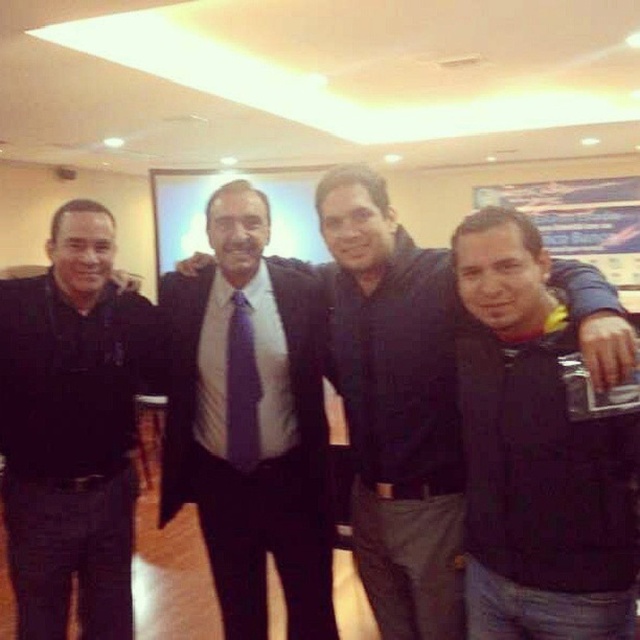
Between point (448, 525) and point (244, 385), which one is positioned behind?

Point (244, 385)

Looking at this image, does matte black suit at center have a lesser width compared to purple textured tie at center?

No.

Image resolution: width=640 pixels, height=640 pixels. What do you see at coordinates (396, 404) in the screenshot?
I see `matte black suit at center` at bounding box center [396, 404].

Find the location of a particular element. This screenshot has width=640, height=640. matte black suit at center is located at coordinates (396, 404).

Which is above, black fabric jacket at right or purple textured tie at center?

Positioned higher is purple textured tie at center.

Looking at this image, does black fabric jacket at right have a greater width compared to purple textured tie at center?

Yes.

This screenshot has height=640, width=640. Identify the location of black fabric jacket at right. (536, 456).

Can you confirm if black fabric jacket at right is wider than black uniform at left?

No.

Between point (499, 321) and point (4, 412), which one is positioned in front?

Point (499, 321) is in front.

Find the location of `black fabric jacket at right`. black fabric jacket at right is located at coordinates (536, 456).